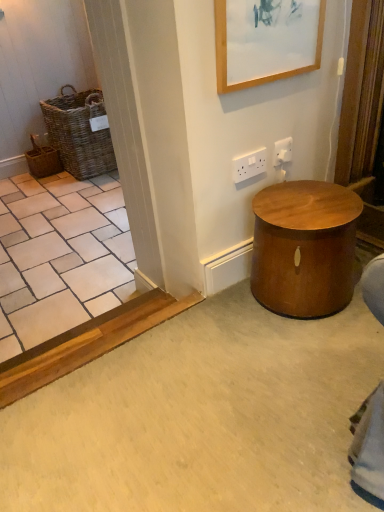
Question: Is white plastic electric outlet at upper right, acting as the 1th electric outlet starting from the right, placed right next to wooden picture frame at upper center?

Choices:
 (A) no
 (B) yes

Answer: (A)

Question: Considering the relative sizes of white plastic electric outlet at upper right, the second electric outlet in the left-to-right sequence, and wooden picture frame at upper center in the image provided, is white plastic electric outlet at upper right, the second electric outlet in the left-to-right sequence, smaller than wooden picture frame at upper center?

Choices:
 (A) yes
 (B) no

Answer: (A)

Question: Is white plastic electric outlet at upper right, the second electric outlet in the left-to-right sequence, turned away from wooden picture frame at upper center?

Choices:
 (A) no
 (B) yes

Answer: (A)

Question: Can you confirm if white plastic electric outlet at upper right, acting as the 1th electric outlet starting from the right, is shorter than wooden picture frame at upper center?

Choices:
 (A) no
 (B) yes

Answer: (B)

Question: From the image's perspective, does white plastic electric outlet at upper right, the second electric outlet in the left-to-right sequence, appear higher than wooden picture frame at upper center?

Choices:
 (A) no
 (B) yes

Answer: (A)

Question: From a real-world perspective, is white plastic electric outlet at upper right, acting as the 1th electric outlet starting from the right, under wooden picture frame at upper center?

Choices:
 (A) no
 (B) yes

Answer: (B)

Question: Is woven brown basket at left, arranged as the 2th basket when viewed from the right, located within white plastic electric outlet at upper center, marked as the second electric outlet in a right-to-left arrangement?

Choices:
 (A) no
 (B) yes

Answer: (A)

Question: Are white plastic electric outlet at upper center, placed as the 1th electric outlet when sorted from left to right, and woven brown basket at left, arranged as the 2th basket when viewed from the right, beside each other?

Choices:
 (A) no
 (B) yes

Answer: (A)

Question: Considering the relative sizes of white plastic electric outlet at upper center, placed as the 1th electric outlet when sorted from left to right, and woven brown basket at left, arranged as the 2th basket when viewed from the right, in the image provided, is white plastic electric outlet at upper center, placed as the 1th electric outlet when sorted from left to right, smaller than woven brown basket at left, arranged as the 2th basket when viewed from the right,?

Choices:
 (A) no
 (B) yes

Answer: (B)

Question: Does white plastic electric outlet at upper center, marked as the second electric outlet in a right-to-left arrangement, come behind woven brown basket at left, arranged as the 2th basket when viewed from the right?

Choices:
 (A) yes
 (B) no

Answer: (B)

Question: From the image's perspective, is white plastic electric outlet at upper center, placed as the 1th electric outlet when sorted from left to right, located above woven brown basket at left, arranged as the 2th basket when viewed from the right?

Choices:
 (A) no
 (B) yes

Answer: (A)

Question: Does white plastic electric outlet at upper center, placed as the 1th electric outlet when sorted from left to right, come in front of woven brown basket at left, which is the 1th basket in left-to-right order?

Choices:
 (A) yes
 (B) no

Answer: (A)

Question: Are wooden picture frame at upper center and woven brown basket at left, the second basket positioned from the left, making contact?

Choices:
 (A) no
 (B) yes

Answer: (A)